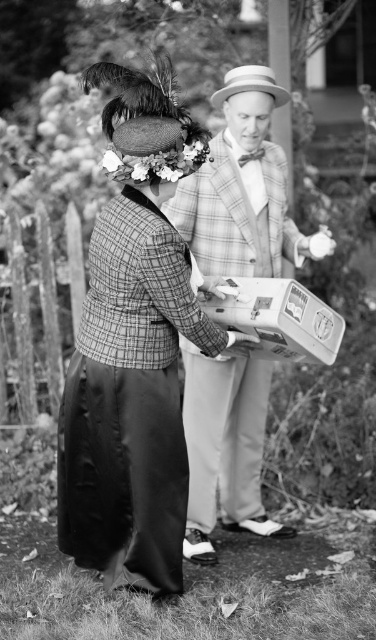
Is plaid wool suit at center below floral bouquet at center?

No, plaid wool suit at center is not below floral bouquet at center.

Between plaid wool suit at center and floral bouquet at center, which one appears on the right side from the viewer's perspective?

From the viewer's perspective, plaid wool suit at center appears more on the right side.

Where is `plaid wool suit at center`? The width and height of the screenshot is (376, 640). plaid wool suit at center is located at coordinates (244, 188).

Is plaid wool jacket at center smaller than floral bouquet at center?

Incorrect, plaid wool jacket at center is not smaller in size than floral bouquet at center.

Between plaid wool jacket at center and floral bouquet at center, which one has less height?

floral bouquet at center is shorter.

Between point (142, 385) and point (121, 177), which one is positioned behind?

The point (142, 385) is more distant.

Locate an element on the screen. plaid wool jacket at center is located at coordinates (131, 397).

Is point (150, 100) less distant than point (248, 212)?

Yes, it is in front of point (248, 212).

Who is more distant from viewer, (150, 97) or (257, 273)?

Positioned behind is point (257, 273).

The width and height of the screenshot is (376, 640). Find the location of `plaid wool jacket at center`. plaid wool jacket at center is located at coordinates (131, 397).